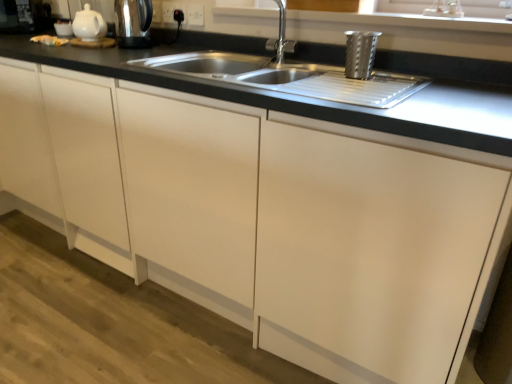
Question: Is metallic stainless steel kettle at upper left, the 2th appliance in the front-to-back sequence, at the right side of black plastic socket at upper center, marked as the 2th electric outlet in a right-to-left arrangement?

Choices:
 (A) no
 (B) yes

Answer: (A)

Question: Could black plastic socket at upper center, marked as the first electric outlet in a left-to-right arrangement, be considered to be inside metallic stainless steel kettle at upper left, the second appliance when ordered from right to left?

Choices:
 (A) yes
 (B) no

Answer: (B)

Question: Is metallic stainless steel kettle at upper left, the second appliance in the bottom-to-top sequence, thinner than black plastic socket at upper center, marked as the 2th electric outlet in a right-to-left arrangement?

Choices:
 (A) yes
 (B) no

Answer: (B)

Question: Is metallic stainless steel kettle at upper left, the first appliance viewed from the back, looking in the opposite direction of black plastic socket at upper center, marked as the 2th electric outlet in a right-to-left arrangement?

Choices:
 (A) yes
 (B) no

Answer: (A)

Question: Considering the relative sizes of metallic stainless steel kettle at upper left, the first appliance from the left, and black plastic socket at upper center, marked as the first electric outlet in a left-to-right arrangement, in the image provided, is metallic stainless steel kettle at upper left, the first appliance from the left, taller than black plastic socket at upper center, marked as the first electric outlet in a left-to-right arrangement,?

Choices:
 (A) yes
 (B) no

Answer: (A)

Question: Considering the positions of white plastic electric outlet at upper center, which appears as the second electric outlet when viewed from the left, and metallic textured cup at upper right, acting as the second appliance starting from the back, in the image, is white plastic electric outlet at upper center, which appears as the second electric outlet when viewed from the left, bigger or smaller than metallic textured cup at upper right, acting as the second appliance starting from the back,?

Choices:
 (A) small
 (B) big

Answer: (A)

Question: In the image, is white plastic electric outlet at upper center, the first electric outlet from the right, positioned in front of or behind metallic textured cup at upper right, acting as the second appliance starting from the back?

Choices:
 (A) behind
 (B) front

Answer: (A)

Question: From a real-world perspective, is white plastic electric outlet at upper center, the first electric outlet from the right, above or below metallic textured cup at upper right, arranged as the first appliance when ordered from the bottom?

Choices:
 (A) above
 (B) below

Answer: (A)

Question: Considering the relative positions of white plastic electric outlet at upper center, which appears as the second electric outlet when viewed from the left, and metallic textured cup at upper right, arranged as the first appliance when ordered from the bottom, in the image provided, is white plastic electric outlet at upper center, which appears as the second electric outlet when viewed from the left, to the left or to the right of metallic textured cup at upper right, arranged as the first appliance when ordered from the bottom,?

Choices:
 (A) right
 (B) left

Answer: (B)

Question: Considering the positions of point (89, 23) and point (119, 29), is point (89, 23) closer or farther from the camera than point (119, 29)?

Choices:
 (A) farther
 (B) closer

Answer: (B)

Question: From the image's perspective, is white glossy teapot at upper left located above or below metallic stainless steel kettle at upper left, the second appliance in the bottom-to-top sequence?

Choices:
 (A) above
 (B) below

Answer: (A)

Question: Considering the positions of white glossy teapot at upper left and metallic stainless steel kettle at upper left, the second appliance in the bottom-to-top sequence, in the image, is white glossy teapot at upper left bigger or smaller than metallic stainless steel kettle at upper left, the second appliance in the bottom-to-top sequence,?

Choices:
 (A) small
 (B) big

Answer: (A)

Question: Choose the correct answer: Is white glossy teapot at upper left inside metallic stainless steel kettle at upper left, the second appliance in the bottom-to-top sequence, or outside it?

Choices:
 (A) inside
 (B) outside

Answer: (B)

Question: Is black plastic socket at upper center, marked as the first electric outlet in a left-to-right arrangement, bigger or smaller than satin nickel faucet at upper center?

Choices:
 (A) small
 (B) big

Answer: (A)

Question: From a real-world perspective, relative to satin nickel faucet at upper center, is black plastic socket at upper center, marked as the 2th electric outlet in a right-to-left arrangement, vertically above or below?

Choices:
 (A) above
 (B) below

Answer: (A)